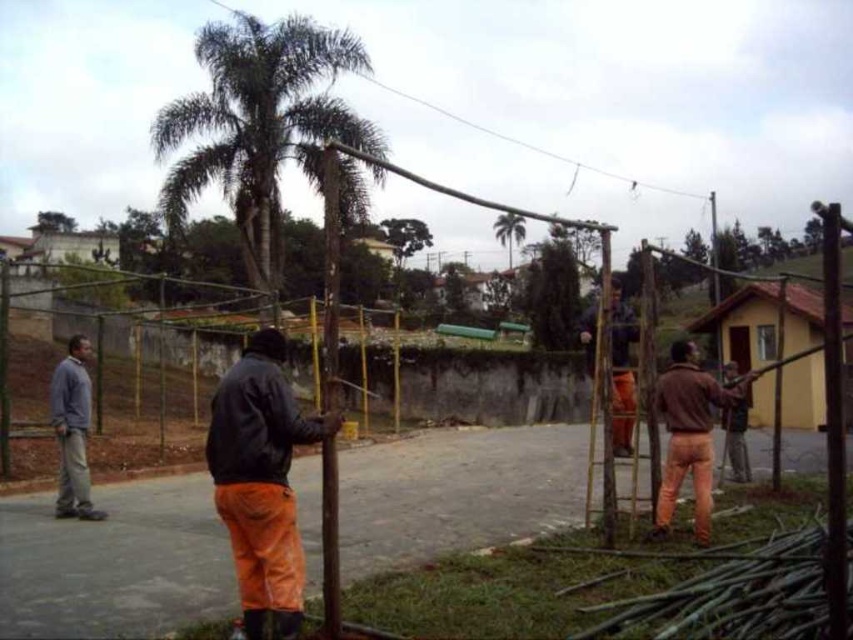
You are a worker in the scene and need to access the green leafy tree at upper center for maintenance. Given that the brown wooden pole at upper center is blocking your view, can you move the pole to the side to get a clear path to the tree?

The brown wooden pole at upper center is in front of the green leafy tree at upper center, so moving the pole aside would allow you to access the tree without obstruction.

You are a construction worker looking at the scene. You need to move the brown wooden pole at upper center and the green leafy tree at upper center to a new location. Which object should you move first if you want to preserve the original spatial relationship between them?

You should move the brown wooden pole at upper center first because it is positioned on the right side of the green leafy tree at upper center. To preserve their original spatial relationship, move the pole after moving the tree so that the pole remains to the right of the tree.